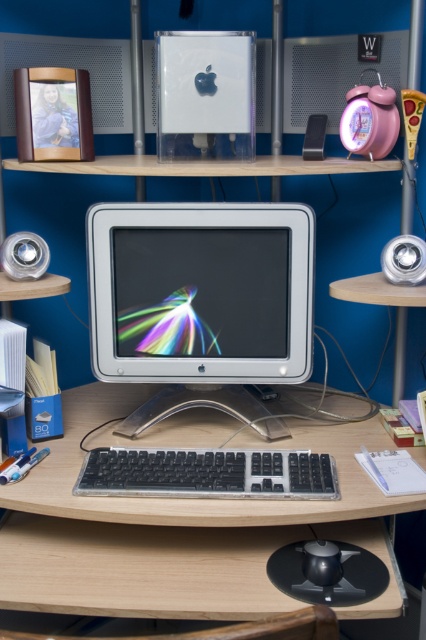
Question: Can you confirm if black plastic keyboard at center is positioned to the left of black plastic mouse at lower center?

Choices:
 (A) no
 (B) yes

Answer: (B)

Question: Which of the following is the farthest from the observer?

Choices:
 (A) (127, 449)
 (B) (299, 348)

Answer: (B)

Question: Which point appears closest to the camera in this image?

Choices:
 (A) (307, 451)
 (B) (310, 145)
 (C) (305, 577)
 (D) (180, 262)

Answer: (C)

Question: Which is nearer to the satin silver monitor at center?

Choices:
 (A) black plastic keyboard at center
 (B) wooden table at right
 (C) black plastic mouse at lower center
 (D) clear wood computer desk at center

Answer: (D)

Question: Is clear wood computer desk at center positioned in front of satin silver monitor at center?

Choices:
 (A) no
 (B) yes

Answer: (B)

Question: Can you confirm if clear wood computer desk at center is thinner than satin silver monitor at center?

Choices:
 (A) no
 (B) yes

Answer: (A)